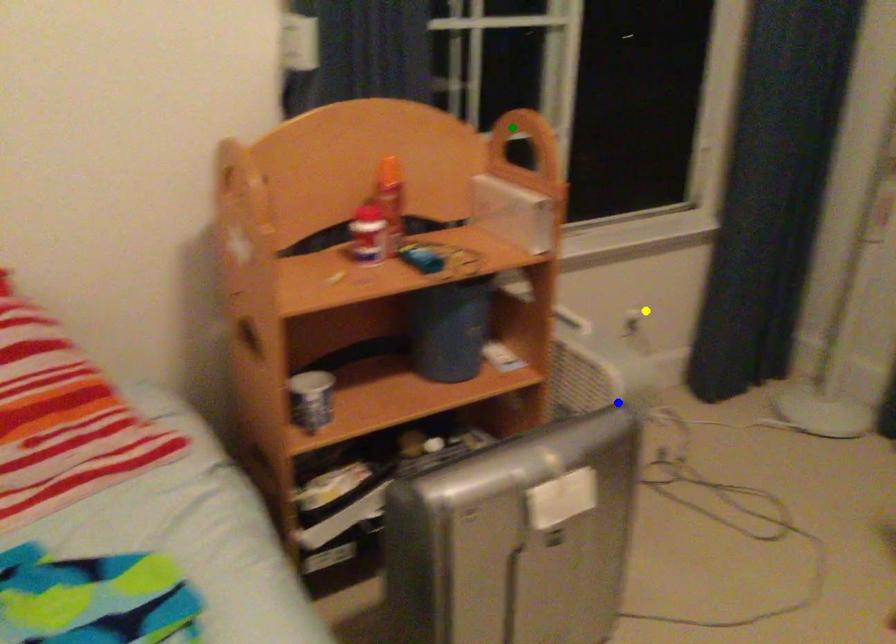
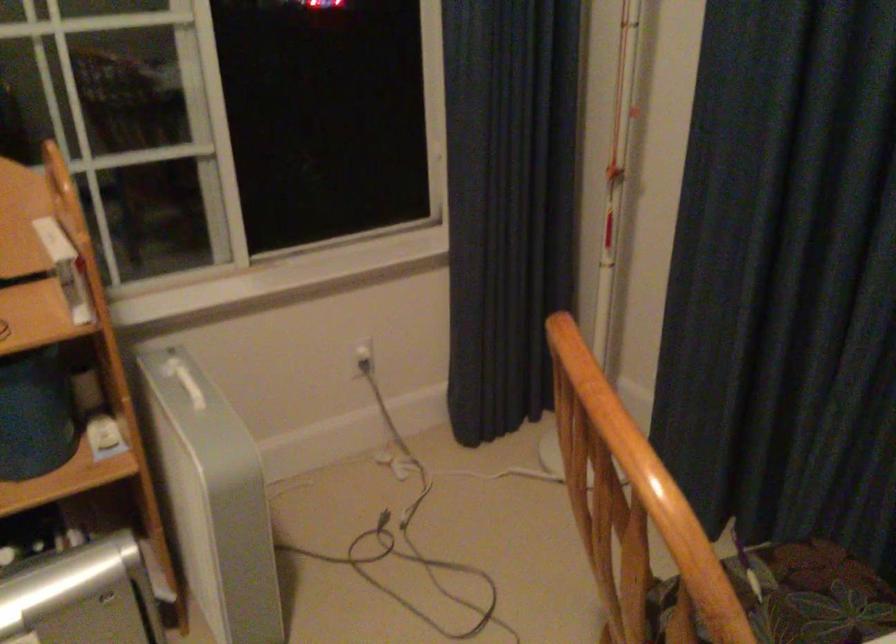
I am providing you with two images of the same scene from different viewpoints. Three points are marked in image1. Which point corresponds to a part or object that is occluded in image2?In image1, three points are marked. Which of them correspond to a part or object that is occluded in image2?Among the three points shown in image1, which one corresponds to a part or object that is no longer visible due to occlusion in image2?

green point cannot be seen in image2.